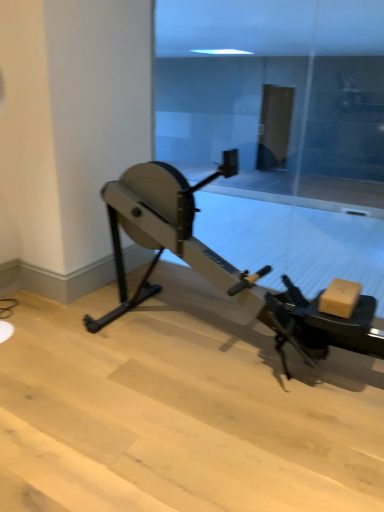
This screenshot has width=384, height=512. I want to click on vacant position to the left of metallic gray stationary bicycle at center, so click(75, 355).